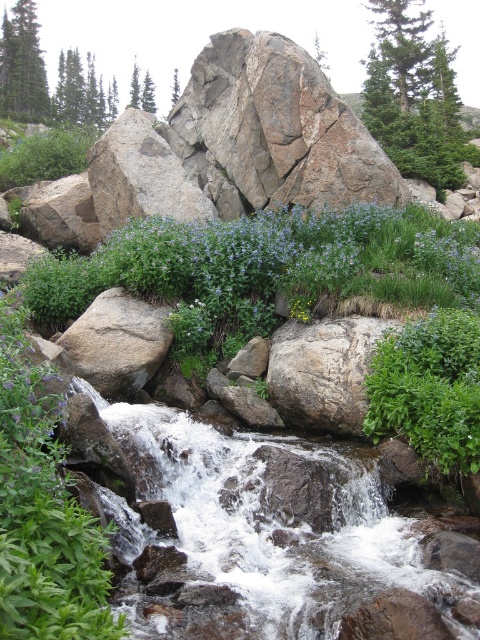
Question: Which of the following is the closest to the observer?

Choices:
 (A) green leafy plant at center
 (B) rough granite rock at center
 (C) blue-green leafy plant at center
 (D) green matte flower at center

Answer: (A)

Question: From the image, what is the correct spatial relationship of blue-green leafy plant at center in relation to green matte flower at center?

Choices:
 (A) right
 (B) left

Answer: (B)

Question: Is gray rough rock at center-left positioned in front of green matte flower at center?

Choices:
 (A) no
 (B) yes

Answer: (B)

Question: Which point is closer to the camera?

Choices:
 (A) (357, 401)
 (B) (228, 262)
 (C) (304, 301)

Answer: (A)

Question: Is gray rough rock at center-left closer to camera compared to green matte flower at center?

Choices:
 (A) yes
 (B) no

Answer: (A)

Question: Which point is closer to the camera?

Choices:
 (A) green leafy plant at center
 (B) green matte flower at center

Answer: (A)